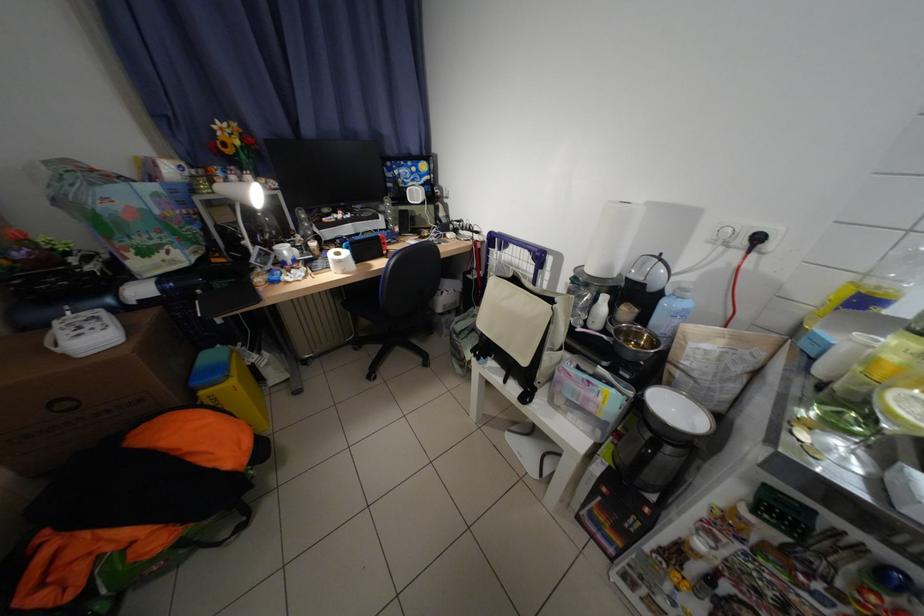
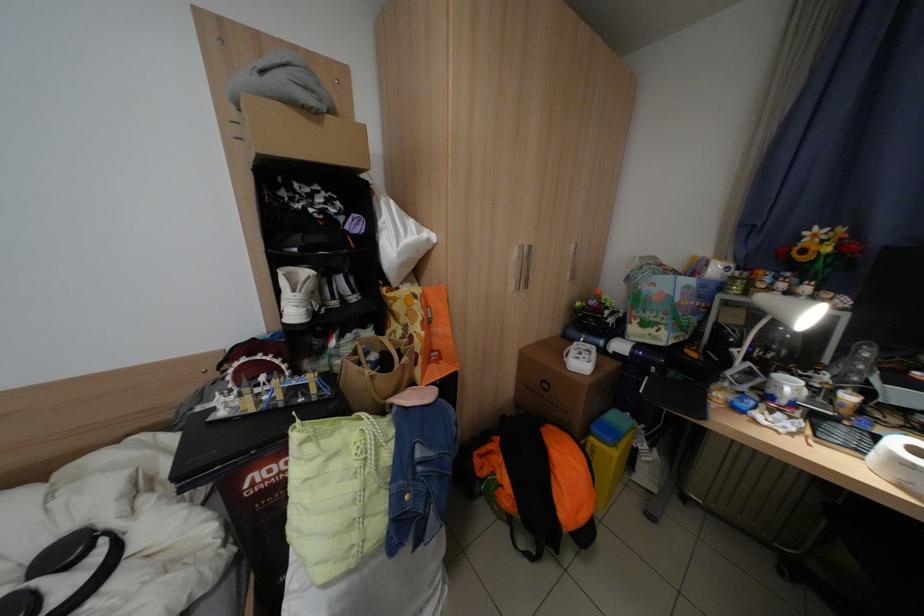
Where in the second image is the point corresponding to the point at 225,474 from the first image?

(565, 508)